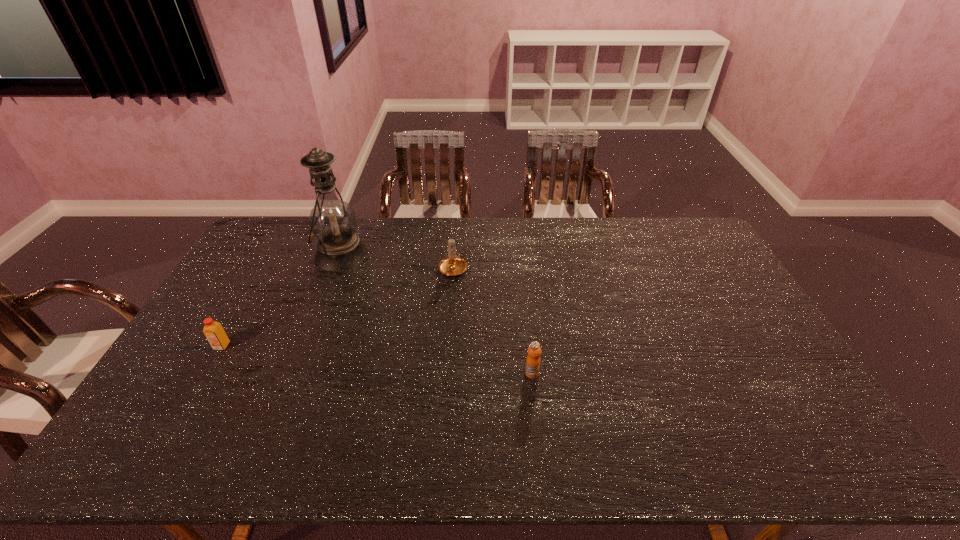
Find the location of a particular element. free point located 0.220m on the front and back of the leftmost object is located at coordinates (180, 420).

This screenshot has height=540, width=960. Identify the location of object at the far edge. (332, 221).

You are a GUI agent. You are given a task and a screenshot of the screen. Output one action in this format:
    pyautogui.click(x=<x>, y=<y>)
    Task: Click on the object at the left edge
    The height and width of the screenshot is (540, 960).
    Given the screenshot: What is the action you would take?
    pyautogui.click(x=213, y=331)

In the image, there is a desktop. Where is `free space at the far edge`? The image size is (960, 540). free space at the far edge is located at coordinates (653, 226).

Where is `vacant region at the near edge`? vacant region at the near edge is located at coordinates (631, 464).

Find the location of a particular element. The width and height of the screenshot is (960, 540). free location at the left edge is located at coordinates (277, 268).

Identify the location of vacant space at the right edge of the desktop. (733, 300).

The image size is (960, 540). I want to click on free space at the far left corner of the desktop, so click(274, 254).

The height and width of the screenshot is (540, 960). I want to click on free region at the far right corner of the desktop, so click(x=681, y=230).

You are a GUI agent. You are given a task and a screenshot of the screen. Output one action in this format:
    pyautogui.click(x=<x>, y=<y>)
    Task: Click on the vacant space at the near right corner
    The image size is (960, 540).
    Given the screenshot: What is the action you would take?
    pyautogui.click(x=831, y=455)